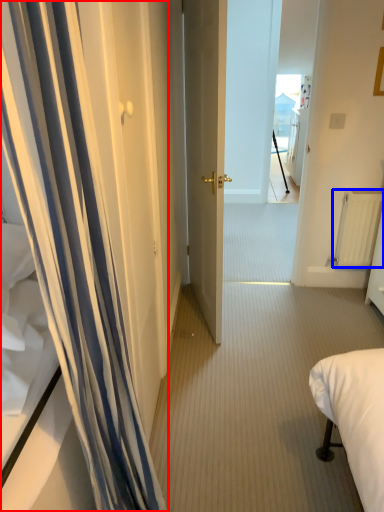
Question: Which of the following is the closest to the observer, curtain (highlighted by a red box) or radiator (highlighted by a blue box)?

Choices:
 (A) curtain
 (B) radiator

Answer: (A)